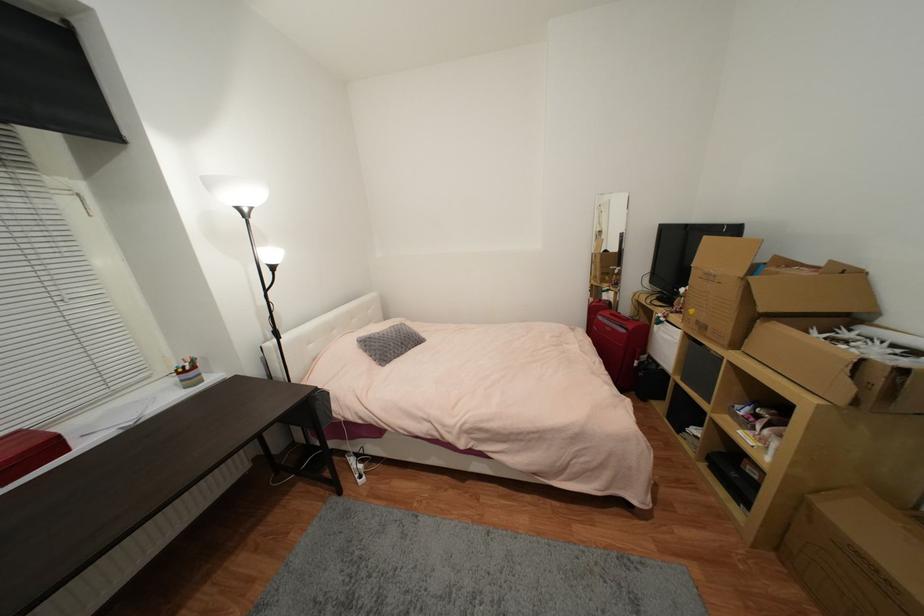
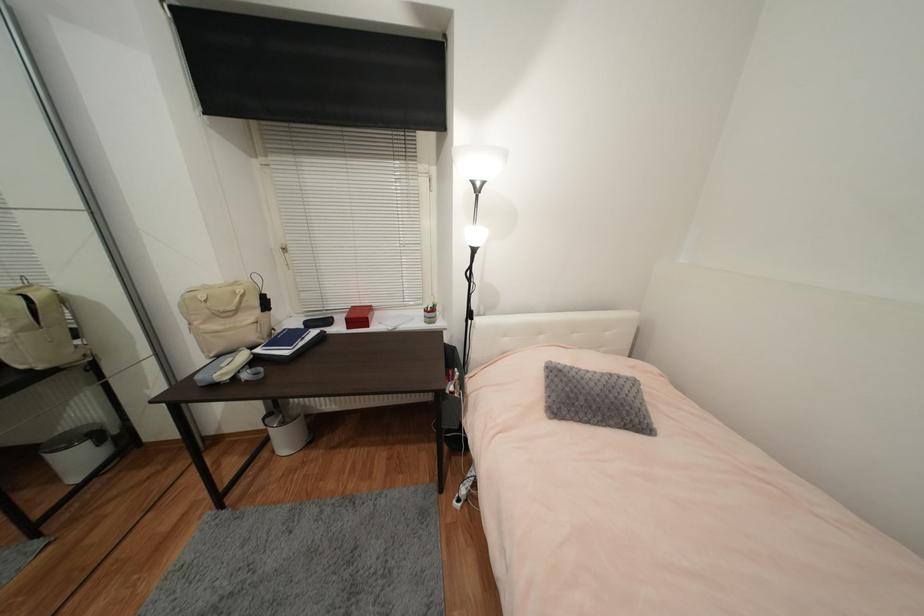
Find the pixel in the second image that matches pixel 283 339 in the first image.

(473, 320)